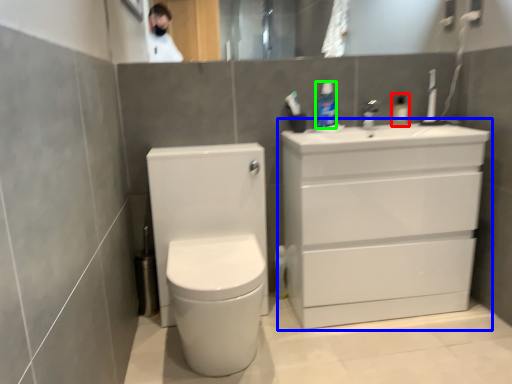
Question: Estimate the real-world distances between objects in this image. Which object is farther from toiletry (highlighted by a red box), bathroom cabinet (highlighted by a blue box) or toiletry (highlighted by a green box)?

Choices:
 (A) bathroom cabinet
 (B) toiletry

Answer: (A)